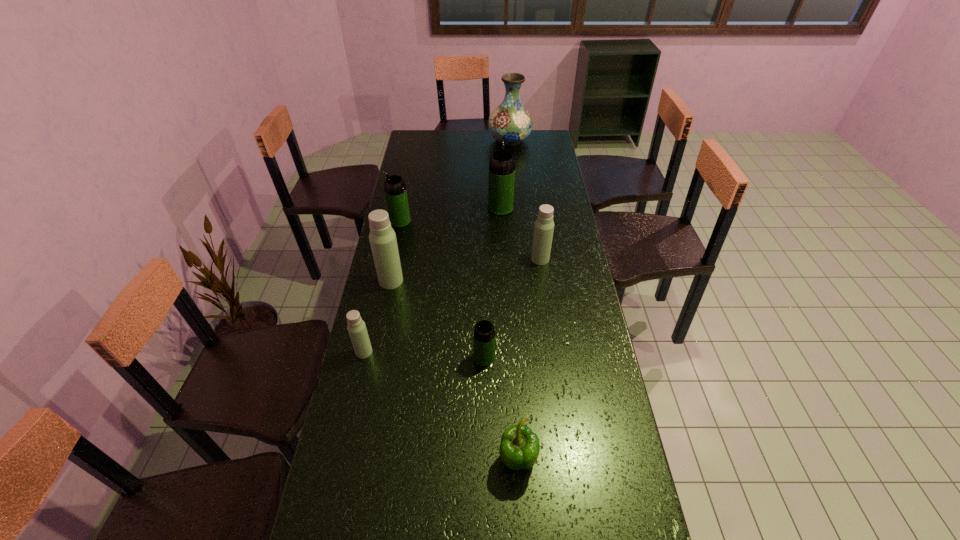
Identify the location of vacant point located between the second biggest light thermos bottle and the green bell pepper. (529, 360).

Image resolution: width=960 pixels, height=540 pixels. In order to click on the fourth closest object to the green bell pepper in this screenshot , I will do `click(544, 225)`.

Identify which object is the fifth nearest to the fourth nearest object. Please provide its 2D coordinates. Your answer should be formatted as a tuple, i.e. [(x, y)], where the tuple contains the x and y coordinates of a point satisfying the conditions above.

[(544, 225)]

Where is `thermos bottle that is the closest one to the farthest light thermos bottle`? The width and height of the screenshot is (960, 540). thermos bottle that is the closest one to the farthest light thermos bottle is located at coordinates click(x=501, y=183).

Locate an element on the screen. thermos bottle that is the third closest to the nearest green thermos bottle is located at coordinates (544, 225).

Locate which green thermos bottle ranks in proximity to the third farthest thermos bottle. Please provide its 2D coordinates. Your answer should be formatted as a tuple, i.e. [(x, y)], where the tuple contains the x and y coordinates of a point satisfying the conditions above.

[(501, 183)]

Select which green thermos bottle appears as the second closest to the leftmost green thermos bottle. Please provide its 2D coordinates. Your answer should be formatted as a tuple, i.e. [(x, y)], where the tuple contains the x and y coordinates of a point satisfying the conditions above.

[(484, 333)]

Locate an element on the screen. The image size is (960, 540). light thermos bottle that can be found as the second closest to the smallest light thermos bottle is located at coordinates (544, 225).

You are a GUI agent. You are given a task and a screenshot of the screen. Output one action in this format:
    pyautogui.click(x=<x>, y=<y>)
    Task: Click on the light thermos bottle that stands as the closest to the fourth farthest object
    Image resolution: width=960 pixels, height=540 pixels.
    Given the screenshot: What is the action you would take?
    pyautogui.click(x=382, y=237)

At what (x,y) coordinates should I click in order to perform the action: click on free space that satisfies the following two spatial constraints: 1. on the back side of the farthest light thermos bottle; 2. on the left side of the green bell pepper. Please return your answer as a coordinate pair (x, y). This screenshot has height=540, width=960. Looking at the image, I should click on (505, 259).